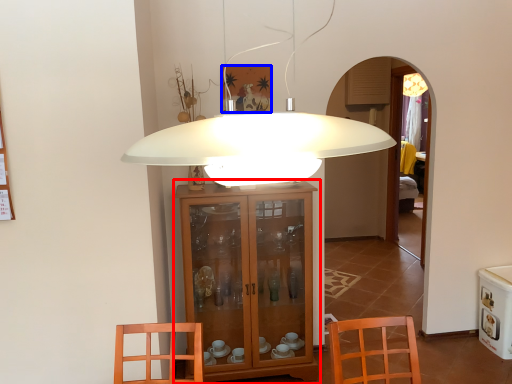
Question: Which object is further to the camera taking this photo, cabinetry (highlighted by a red box) or picture frame (highlighted by a blue box)?

Choices:
 (A) cabinetry
 (B) picture frame

Answer: (B)